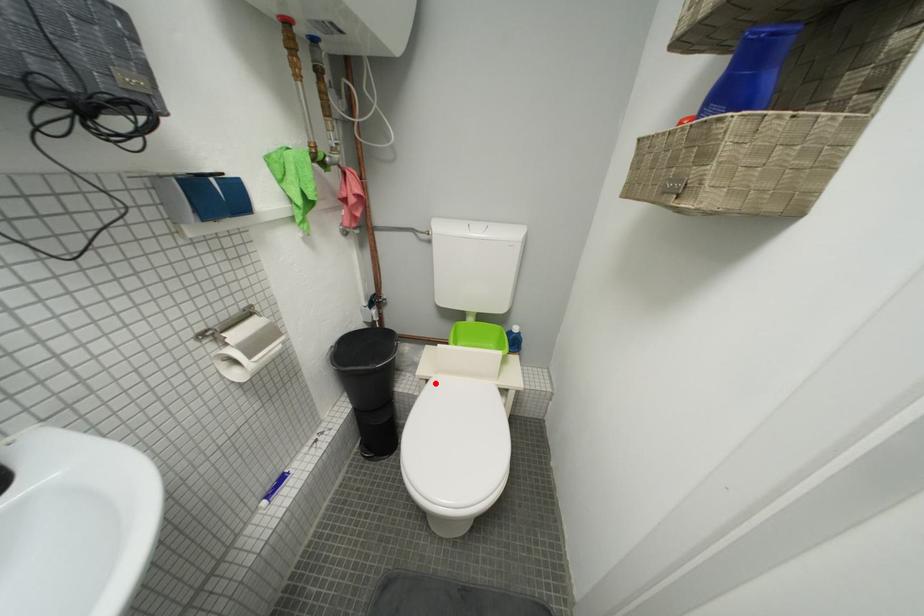
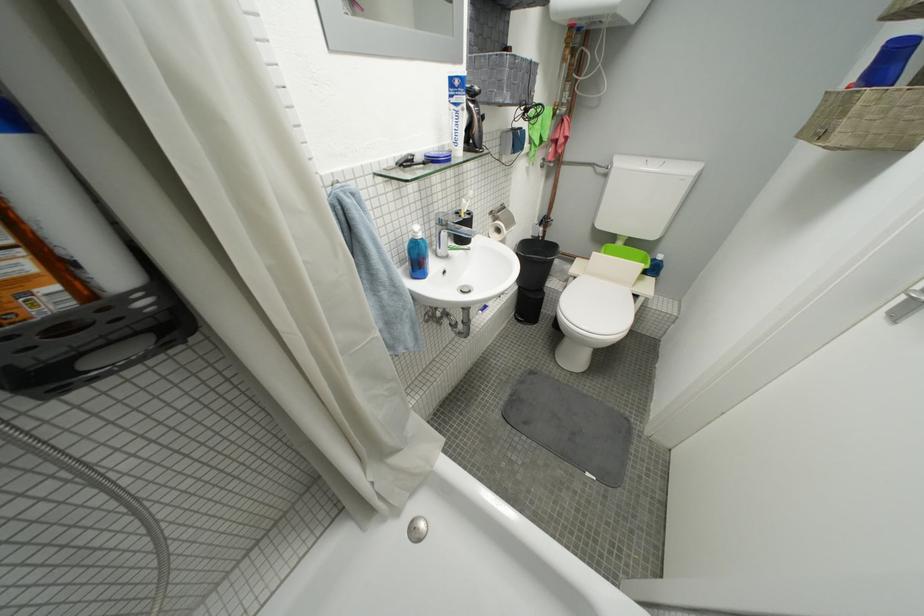
Question: I am providing you with two images of the same scene from different viewpoints. A red point is marked on the first image. Is the red point's position out of view in image 2?

Choices:
 (A) Yes
 (B) No

Answer: (B)